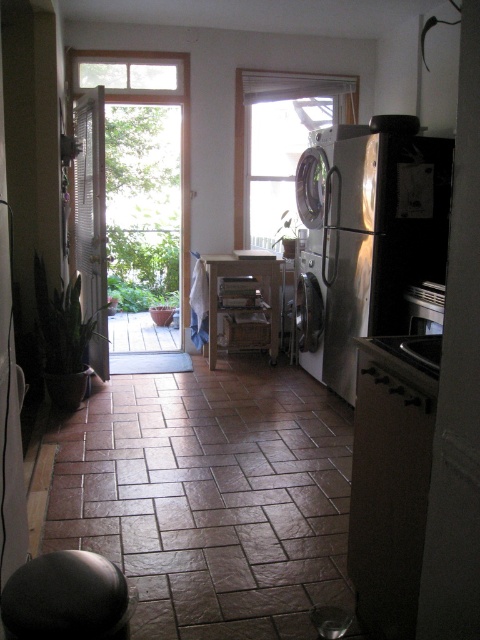
You are standing in the kitchen and want to see outside through the transparent glass window at center. Is the window taller than the satin silver dishwasher at center?

The transparent glass window at center has a greater height compared to the satin silver dishwasher at center, so yes, the window is taller than the dishwasher.